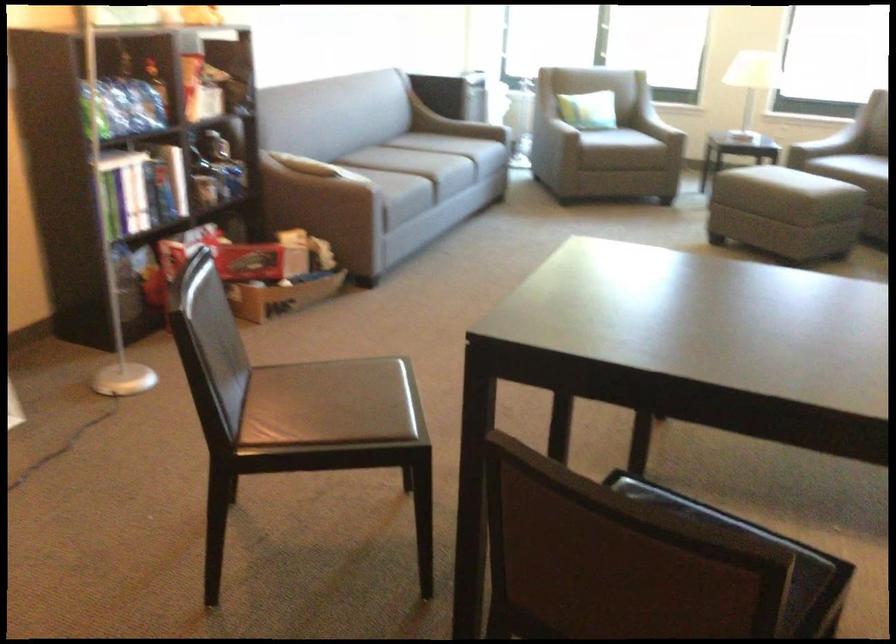
Find the location of a particular element. sofa sitting surface is located at coordinates (392, 160).